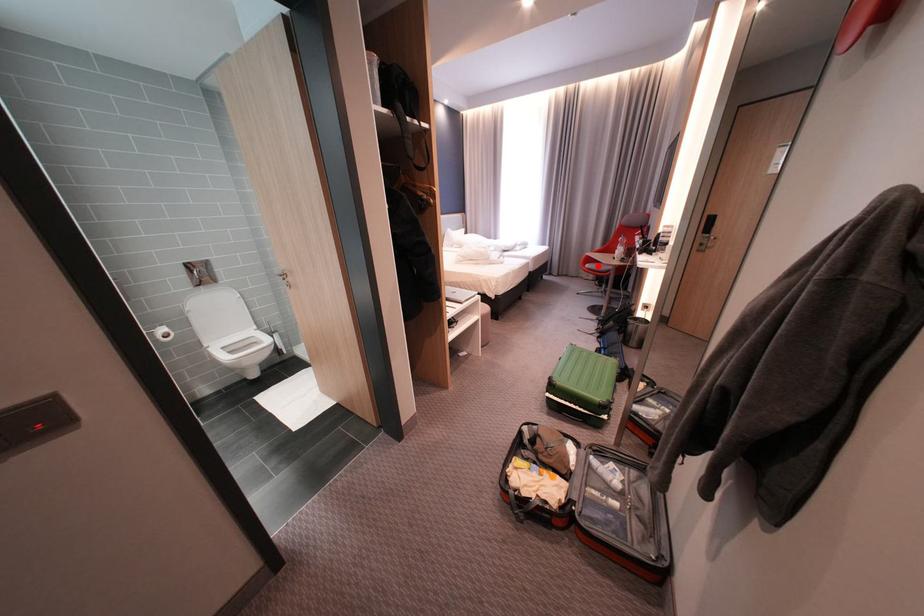
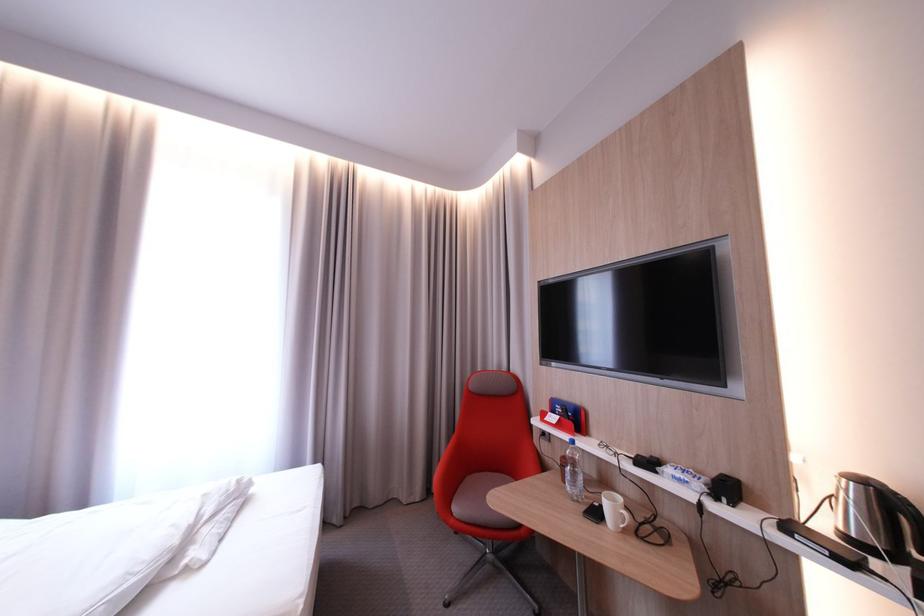
Locate, in the second image, the point that corresponds to the highlighted location in the first image.

(467, 511)